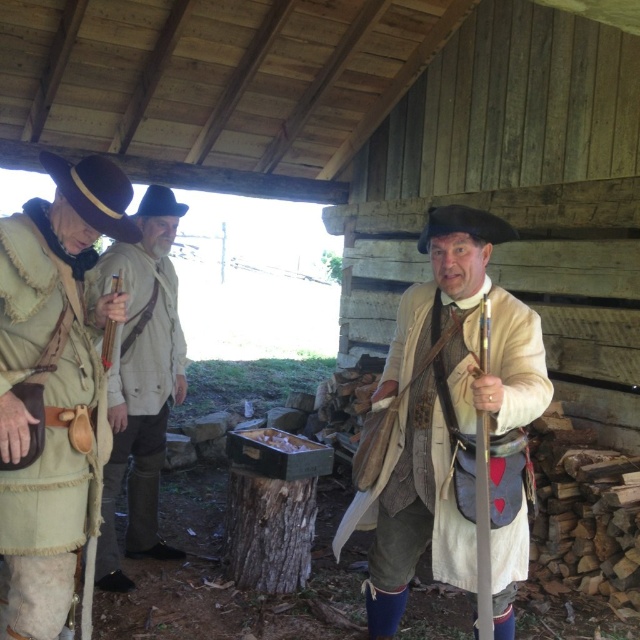
I want to click on light beige fabric coat at center, so click(x=449, y=428).

Is point (512, 424) less distant than point (65, 348)?

No, (512, 424) is behind (65, 348).

Is point (396, 616) in front of point (35, 445)?

No, (396, 616) is behind (35, 445).

Find the location of a particular element. This screenshot has height=640, width=640. light beige fabric coat at center is located at coordinates (449, 428).

Is leather belt at left smaller than light brown leather jacket at center?

Yes.

Who is lower down, leather belt at left or light brown leather jacket at center?

light brown leather jacket at center is lower down.

What do you see at coordinates (52, 387) in the screenshot?
I see `leather belt at left` at bounding box center [52, 387].

Find the location of a particular element. leather belt at left is located at coordinates (52, 387).

Can you confirm if light beige fabric coat at center is positioned to the left of light brown leather jacket at center?

No, light beige fabric coat at center is not to the left of light brown leather jacket at center.

Who is positioned more to the left, light beige fabric coat at center or light brown leather jacket at center?

light brown leather jacket at center

The image size is (640, 640). I want to click on light beige fabric coat at center, so tap(449, 428).

At what (x,y) coordinates should I click in order to perform the action: click on light beige fabric coat at center. Please return your answer as a coordinate pair (x, y). The height and width of the screenshot is (640, 640). Looking at the image, I should click on (449, 428).